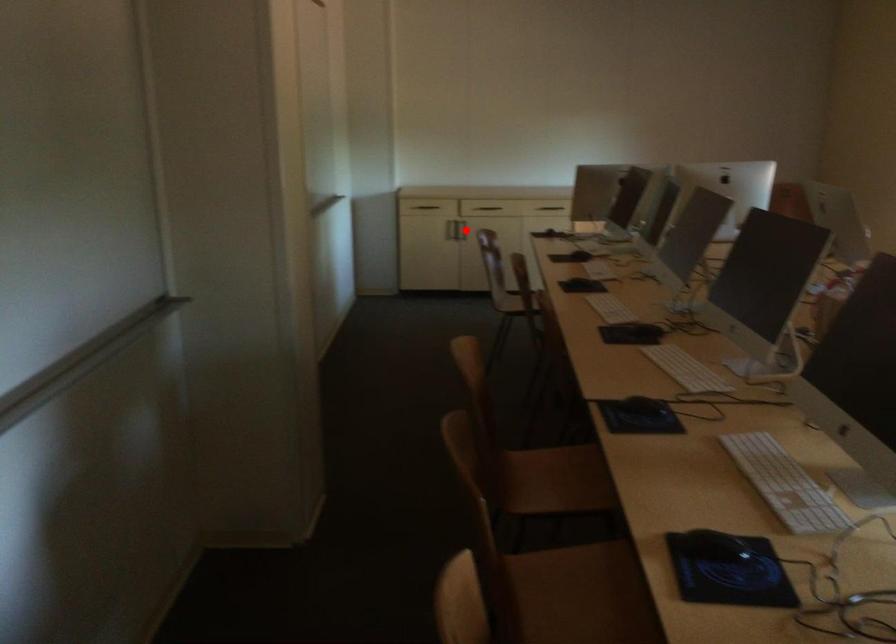
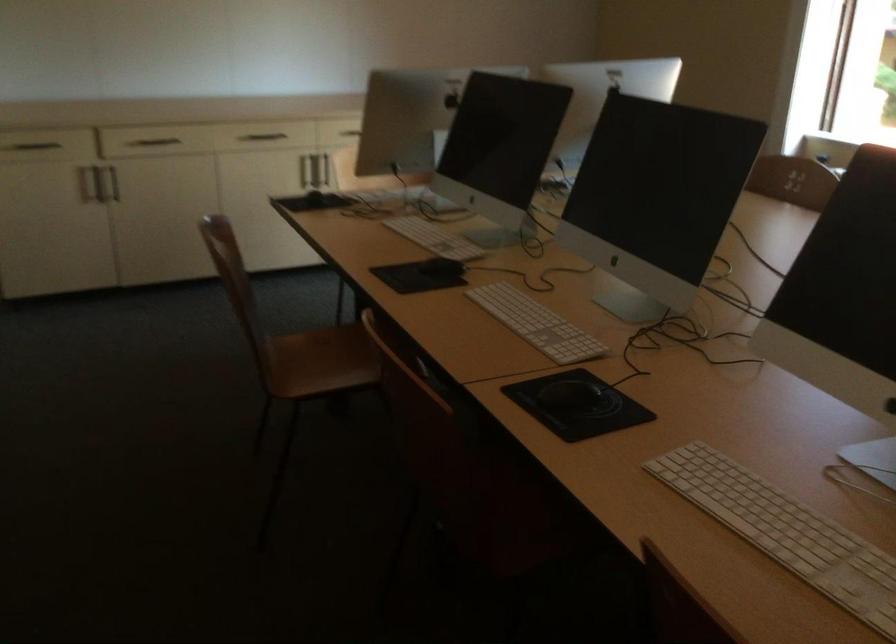
Question: I am providing you with two images of the same scene from different viewpoints. A red point is marked on the first image. Can you still see the location of the red point in image 2?

Choices:
 (A) Yes
 (B) No

Answer: (B)